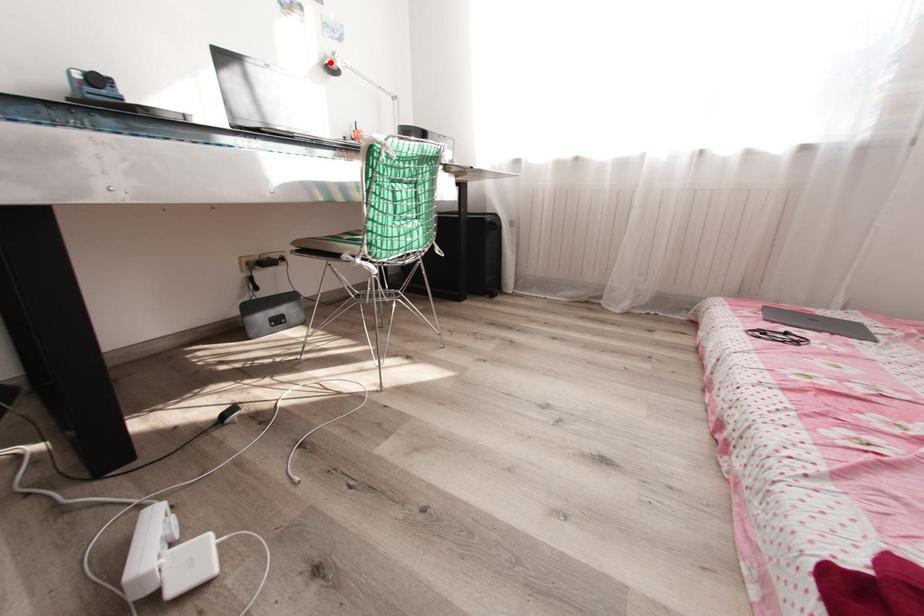
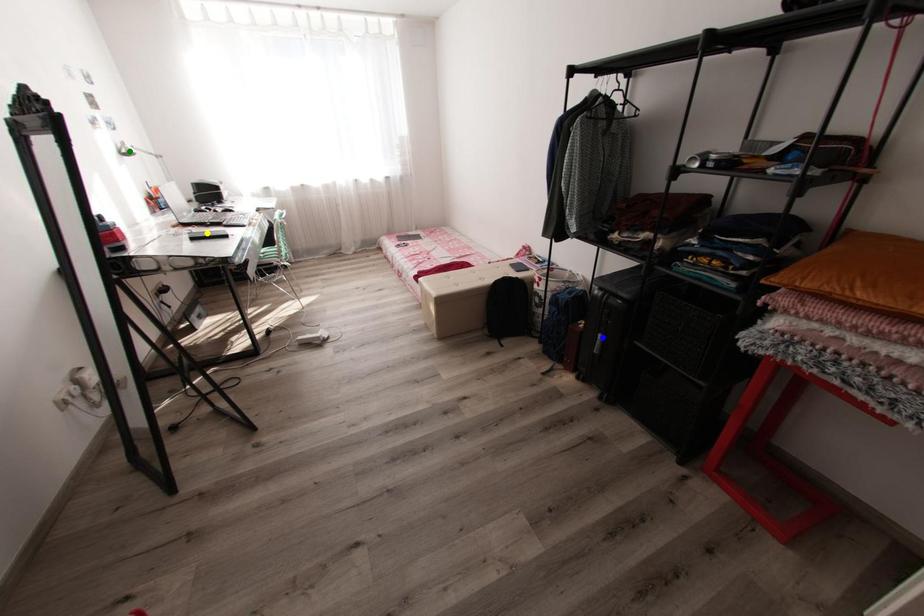
Question: I am providing you with two images of the same scene from different viewpoints. A red point is marked on the first image. You are given multiple points on the second image. Which spot in image 2 lines up with the point in image 1?

Choices:
 (A) yellow point
 (B) blue point
 (C) green point

Answer: (C)